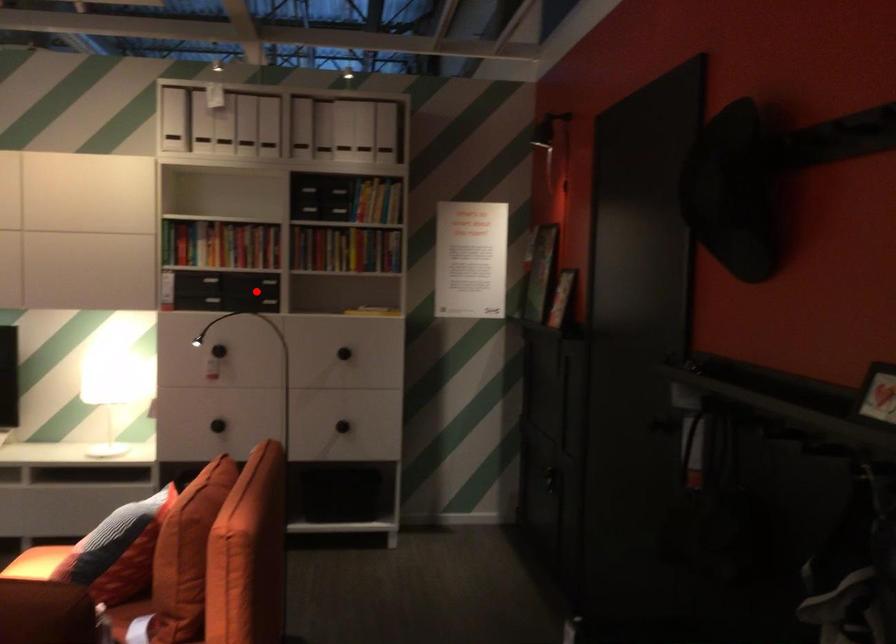
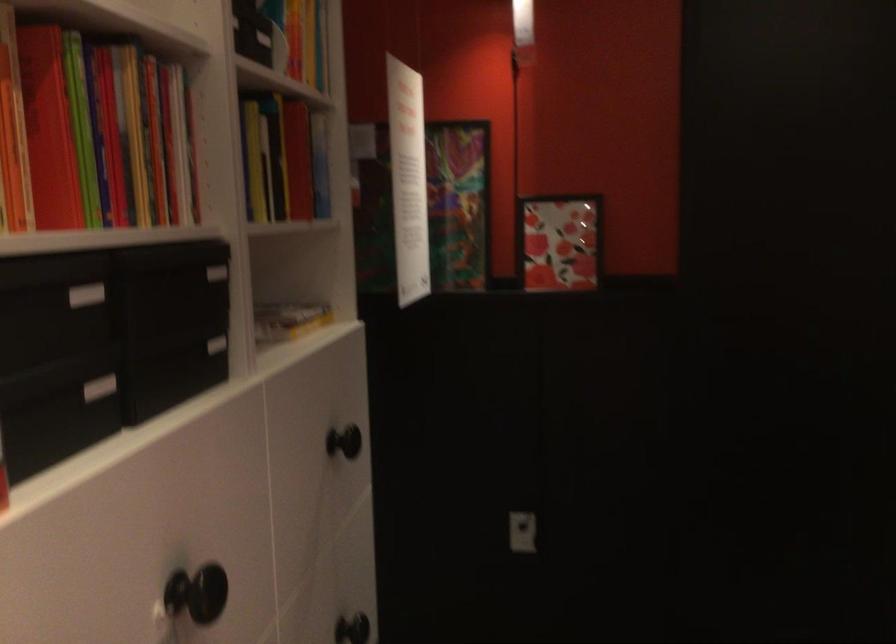
Question: I am providing you with two images of the same scene from different viewpoints. Given a red point in image1, look at the same physical point in image2. Is it:

Choices:
 (A) Closer to the viewpoint
 (B) Farther from the viewpoint

Answer: (A)